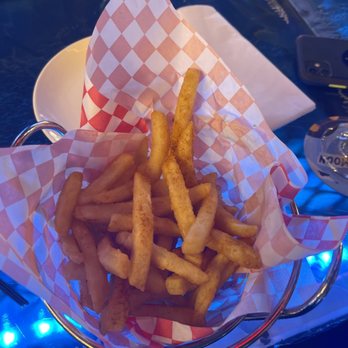
This screenshot has height=348, width=348. Find the location of `blue led lights`. blue led lights is located at coordinates (42, 329), (54, 329), (7, 336), (318, 261), (325, 258), (344, 255).